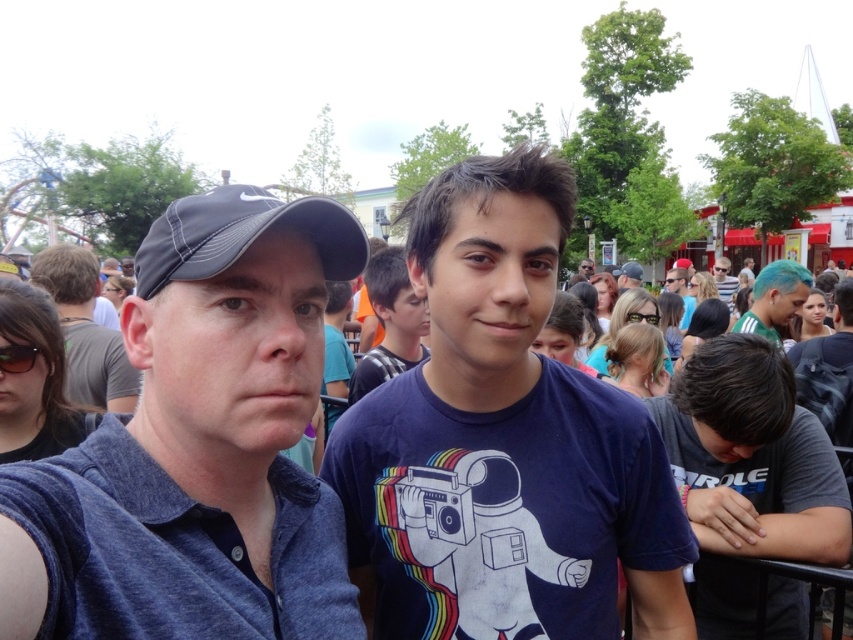
Question: Is dark blue t-shirt at center wider than matte blue shirt at center?

Choices:
 (A) no
 (B) yes

Answer: (B)

Question: Is dark blue fabric shirt at left above matte black cap at upper left?

Choices:
 (A) yes
 (B) no

Answer: (B)

Question: Based on their relative distances, which object is farther from the matte black cap at left?

Choices:
 (A) teal hair at upper right
 (B) matte blue shirt at center
 (C) dark blue t-shirt at center
 (D) matte black shirt at upper center

Answer: (D)

Question: Which object is the closest to the matte black cap at left?

Choices:
 (A) dark blue fabric shirt at left
 (B) teal hair at upper right
 (C) matte black shirt at upper center

Answer: (A)

Question: In this image, where is gray cotton t-shirt at lower right located relative to teal hair at upper right?

Choices:
 (A) right
 (B) left

Answer: (B)

Question: Which object is closer to the camera taking this photo?

Choices:
 (A) matte blue shirt at center
 (B) teal hair at upper right
 (C) dark blue t-shirt at center
 (D) matte black shirt at upper center

Answer: (C)